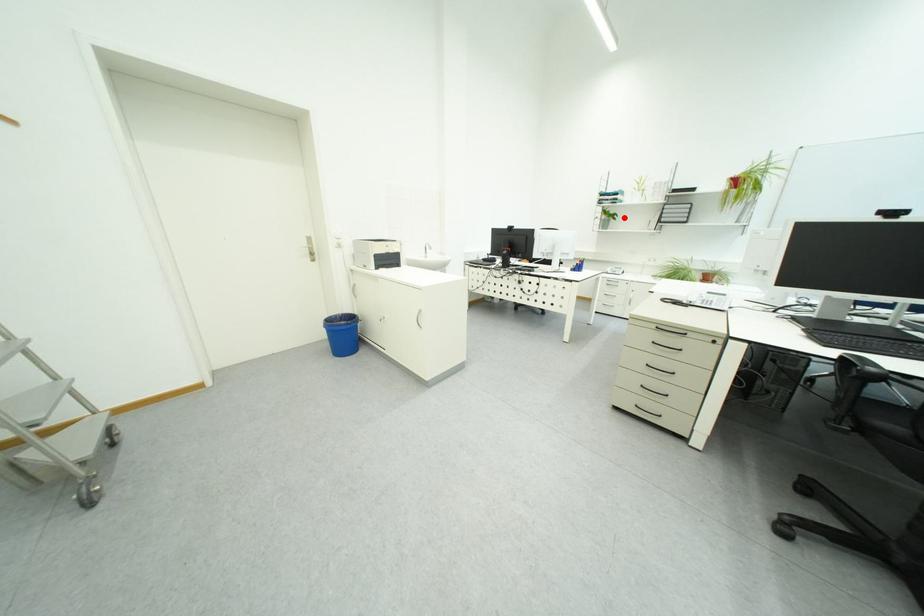
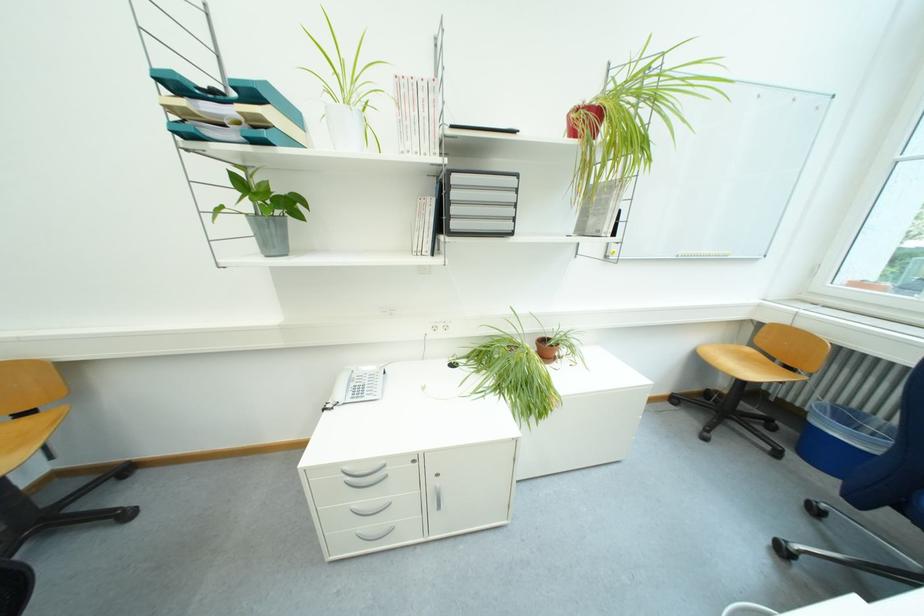
Find the pixel in the second image that matches the highlighted location in the first image.

(302, 206)